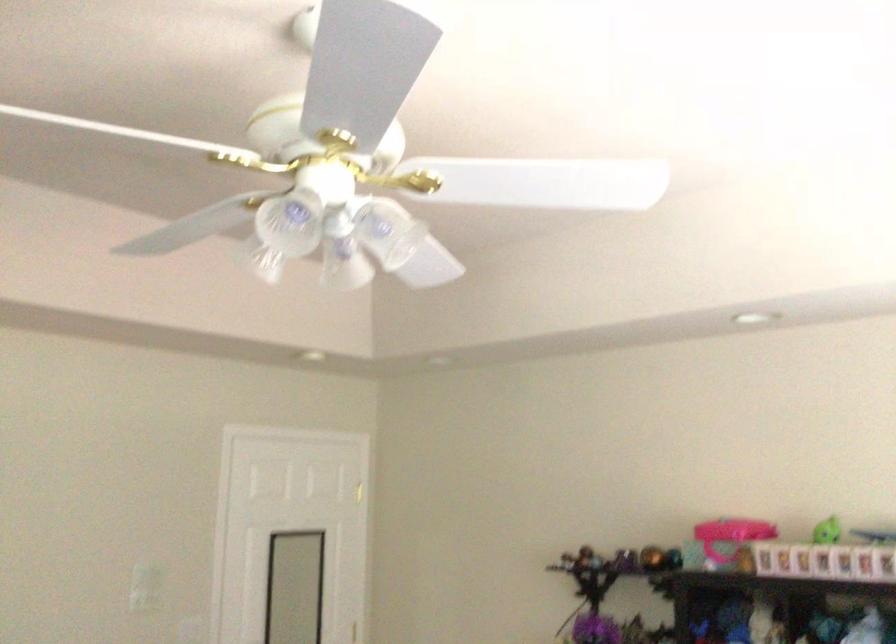
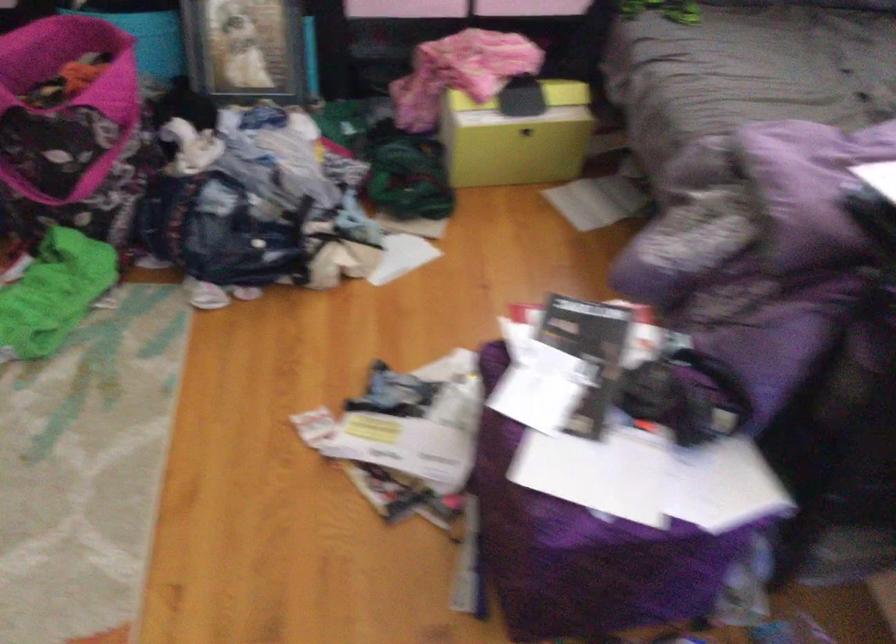
How did the camera likely rotate?

The rotation direction of the camera is right-down.